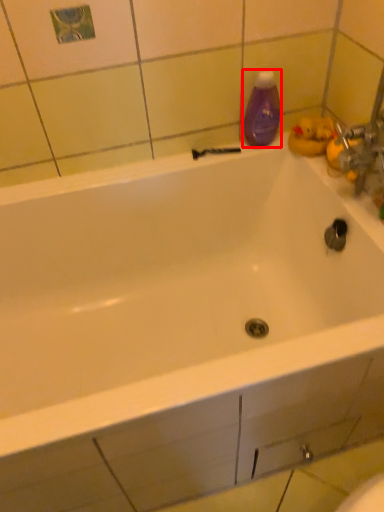
Question: From the image's perspective, what is the correct spatial positioning of cleaning product (annotated by the red box) in reference to shower?

Choices:
 (A) above
 (B) below

Answer: (A)